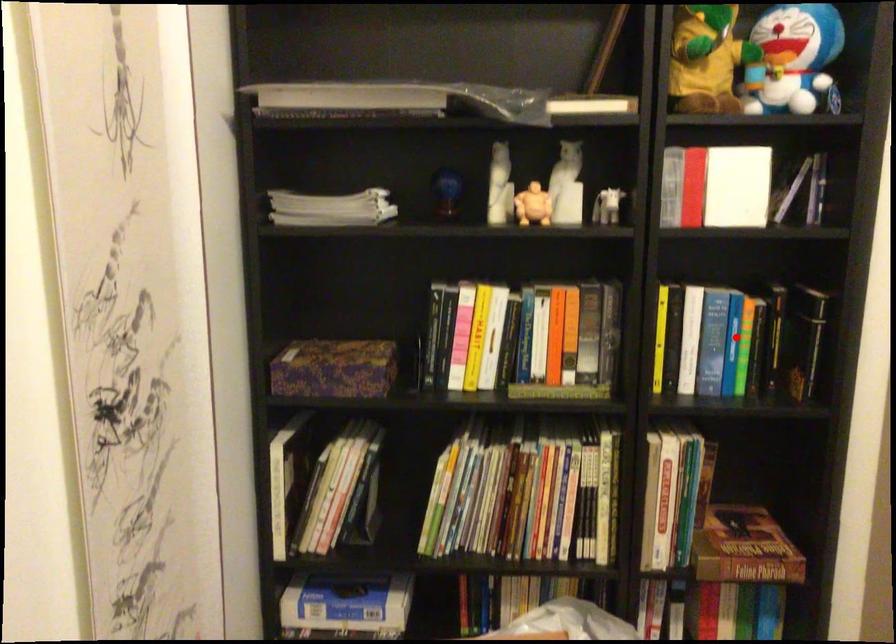
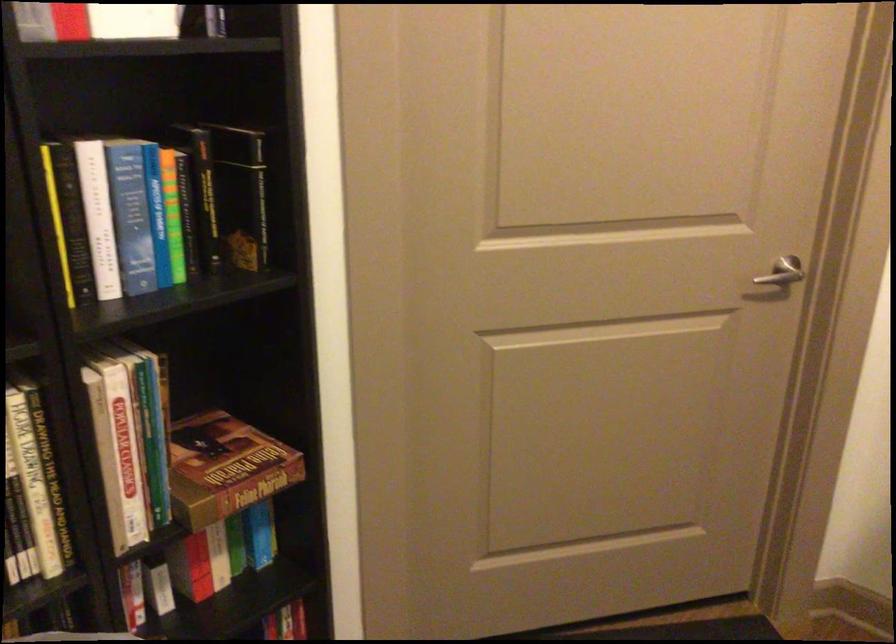
Question: I am providing you with two images of the same scene from different viewpoints. A red point is shown in image1. For the corresponding object point in image2, is it positioned nearer or farther from the camera?

Choices:
 (A) Nearer
 (B) Farther

Answer: (A)